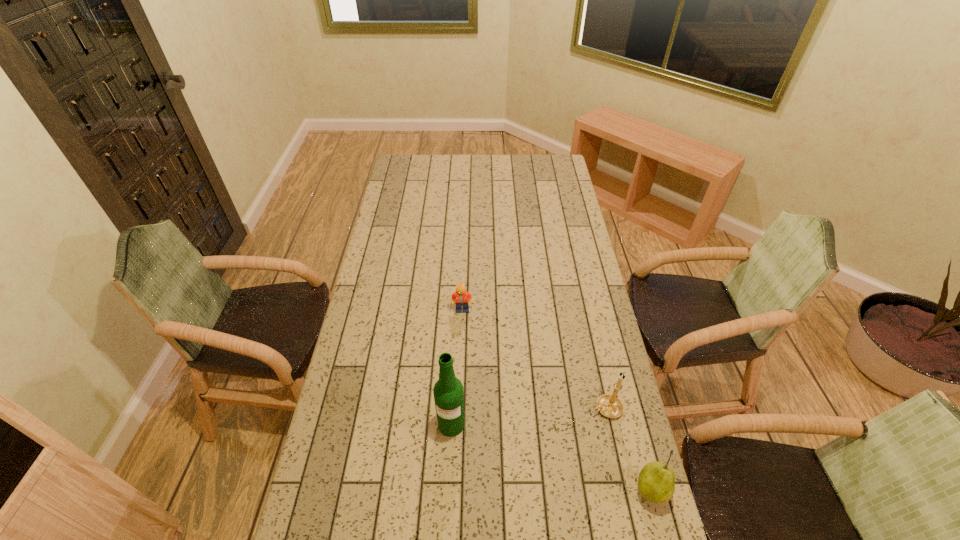
This screenshot has height=540, width=960. Identify the location of empty space that is in between the second tallest object and the nearest object. (628, 449).

Locate an element on the screen. vacant region between the Lego and the nearest object is located at coordinates (556, 400).

The height and width of the screenshot is (540, 960). Identify the location of free space between the farthest object and the tallest object. (457, 367).

Locate an element on the screen. The width and height of the screenshot is (960, 540). blank region between the farthest object and the nearest object is located at coordinates (556, 400).

Where is `free space between the tallest object and the candle holder`? The width and height of the screenshot is (960, 540). free space between the tallest object and the candle holder is located at coordinates pos(529,416).

I want to click on vacant space that is in between the pear and the tallest object, so click(x=551, y=457).

You are a GUI agent. You are given a task and a screenshot of the screen. Output one action in this format:
    pyautogui.click(x=<x>, y=<y>)
    Task: Click on the free spot between the second tallest object and the farthest object
    The image size is (960, 540).
    Given the screenshot: What is the action you would take?
    pyautogui.click(x=535, y=359)

Find the location of a particular element. free spot between the beer bottle and the second tallest object is located at coordinates tap(529, 416).

The height and width of the screenshot is (540, 960). I want to click on vacant region between the pear and the beer bottle, so click(551, 457).

Where is `unoccupied area between the nearest object and the tallest object`? Image resolution: width=960 pixels, height=540 pixels. unoccupied area between the nearest object and the tallest object is located at coordinates (551, 457).